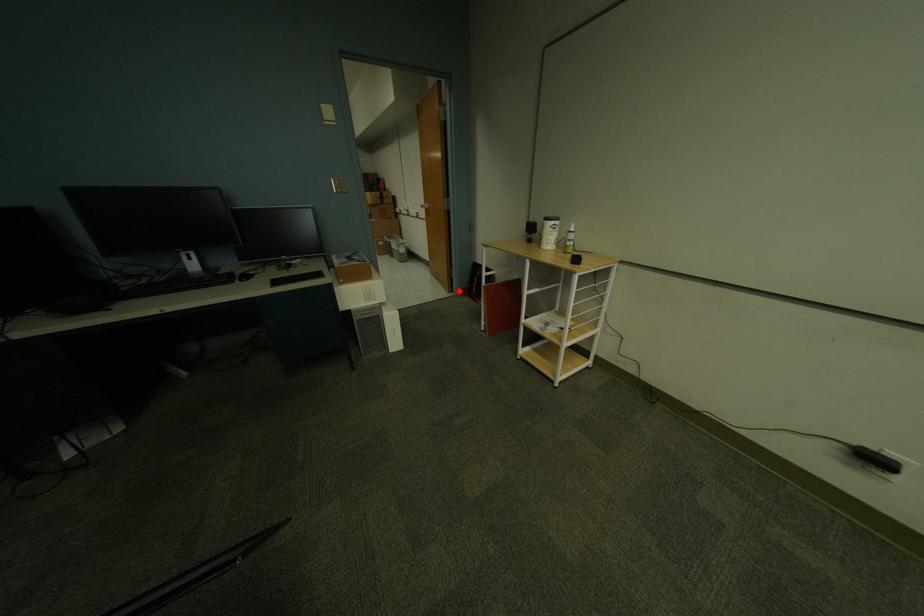
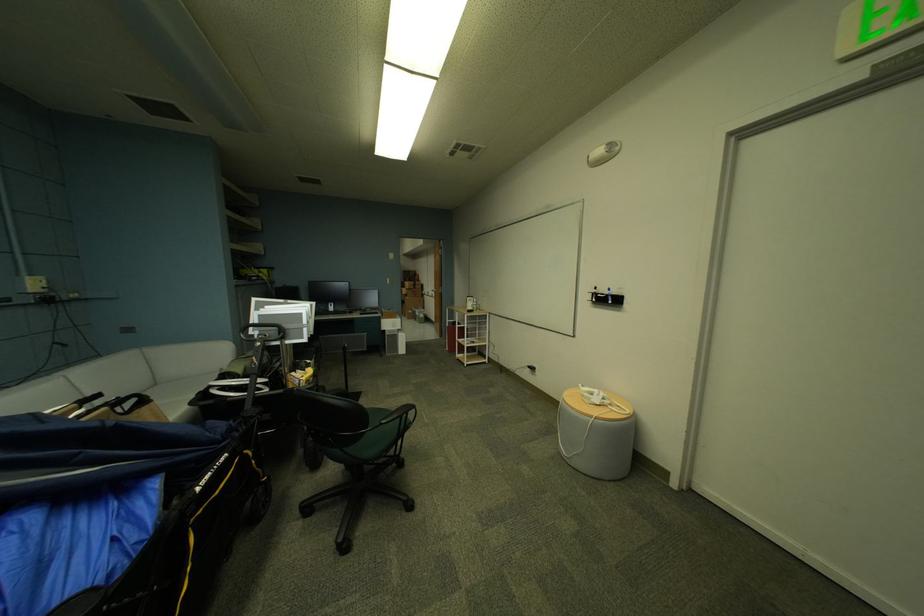
Locate, in the second image, the point that corresponds to the highlighted location in the first image.

(450, 337)